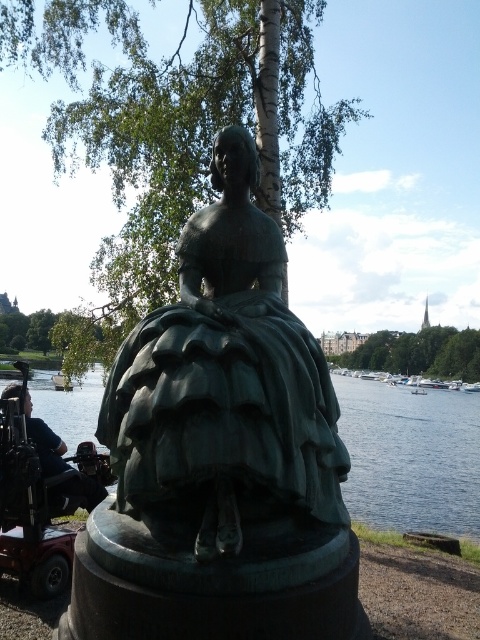
Question: Estimate the real-world distances between objects in this image. Which object is farther from the green patina statue at center?

Choices:
 (A) green bronze statue at center
 (B) metallic red mobility scooter at lower left

Answer: (A)

Question: Is green patina statue at center below metallic red mobility scooter at lower left?

Choices:
 (A) no
 (B) yes

Answer: (A)

Question: Which object is closer to the camera taking this photo?

Choices:
 (A) green patina statue at center
 (B) green bronze statue at center

Answer: (A)

Question: Is green patina statue at center below metallic red mobility scooter at lower left?

Choices:
 (A) no
 (B) yes

Answer: (A)

Question: Is green patina statue at center to the left of metallic red mobility scooter at lower left from the viewer's perspective?

Choices:
 (A) yes
 (B) no

Answer: (B)

Question: Which point is farther to the camera?

Choices:
 (A) (327, 403)
 (B) (408, 525)

Answer: (B)